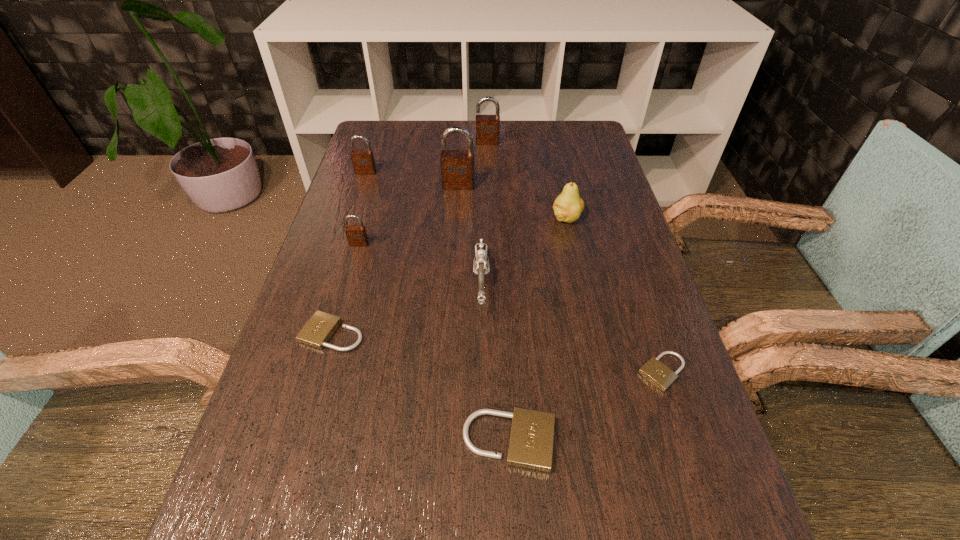
The width and height of the screenshot is (960, 540). What are the coordinates of `free space at the left edge` in the screenshot? It's located at (344, 289).

This screenshot has width=960, height=540. I want to click on vacant space at the right edge, so click(x=585, y=211).

Where is `free space between the farthest object and the second smallest beige padlock`? This screenshot has width=960, height=540. free space between the farthest object and the second smallest beige padlock is located at coordinates (410, 238).

The width and height of the screenshot is (960, 540). Find the location of `vacant space that's between the farthest brown padlock and the rightmost beige padlock`. vacant space that's between the farthest brown padlock and the rightmost beige padlock is located at coordinates (575, 257).

Find the location of a particular element. The height and width of the screenshot is (540, 960). free space that is in between the second smallest beige padlock and the second smallest brown padlock is located at coordinates (349, 253).

You are a GUI agent. You are given a task and a screenshot of the screen. Output one action in this format:
    pyautogui.click(x=<x>, y=<y>)
    Task: Click on the empty location between the tallest object and the third shortest object
    
    Given the screenshot: What is the action you would take?
    pyautogui.click(x=484, y=314)

The height and width of the screenshot is (540, 960). I want to click on free space between the eighth object from left to right and the fifth shortest padlock, so click(466, 195).

Locate an element on the screen. free space between the gun and the leftmost beige padlock is located at coordinates (407, 308).

Where is `free area in between the fourth shortest padlock and the leftmost beige padlock`? This screenshot has height=540, width=960. free area in between the fourth shortest padlock and the leftmost beige padlock is located at coordinates (346, 289).

This screenshot has width=960, height=540. Identify the location of vacant space that is in between the shortest object and the third farthest padlock. (561, 279).